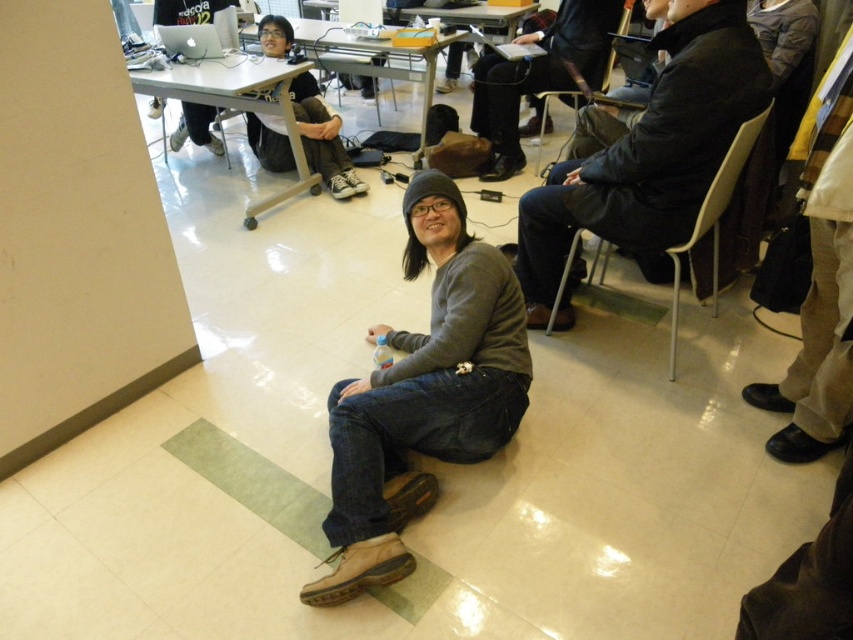
Describe the element at coordinates (712, 218) in the screenshot. I see `white plastic chair at right` at that location.

Is white plastic chair at right behind matte black laptop at upper left?

No, white plastic chair at right is in front of matte black laptop at upper left.

Who is more distant from viewer, (737,177) or (194,131)?

Point (194,131)

Locate an element on the screen. This screenshot has height=640, width=853. white plastic chair at right is located at coordinates (712, 218).

Is point (430, 227) closer to camera compared to point (693, 230)?

That is True.

Find the location of a particular element. Image resolution: width=853 pixels, height=640 pixels. gray matte sweater at center is located at coordinates (422, 394).

Can you confirm if gray matte sweater at center is positioned to the left of dark gray sweater at center?

Indeed, gray matte sweater at center is positioned on the left side of dark gray sweater at center.

Who is more distant from viewer, (436, 404) or (515, 68)?

The point (515, 68) is behind.

Locate an element on the screen. gray matte sweater at center is located at coordinates (422, 394).